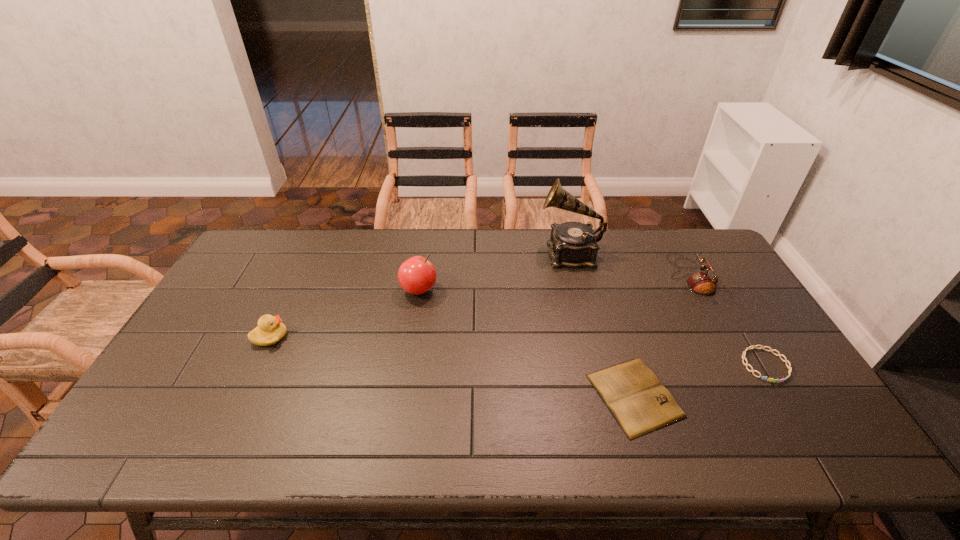
Where is `object that is positioned at the near edge`? The height and width of the screenshot is (540, 960). object that is positioned at the near edge is located at coordinates coord(639,402).

In order to click on telephone situated at the right edge in this screenshot , I will do `click(701, 283)`.

The width and height of the screenshot is (960, 540). I want to click on bracelet located in the right edge section of the desktop, so click(786, 361).

This screenshot has width=960, height=540. Find the location of `object that is at the far right corner`. object that is at the far right corner is located at coordinates (701, 283).

This screenshot has height=540, width=960. I want to click on vacant area at the far edge, so click(x=632, y=230).

Where is `free location at the near edge`? The width and height of the screenshot is (960, 540). free location at the near edge is located at coordinates pyautogui.click(x=286, y=426).

The width and height of the screenshot is (960, 540). What are the coordinates of `vacant area at the left edge of the desktop` in the screenshot? It's located at (234, 310).

Locate an element on the screen. The image size is (960, 540). vacant space at the right edge is located at coordinates (762, 407).

Find the location of `vacant space at the far left corner of the desktop`. vacant space at the far left corner of the desktop is located at coordinates (257, 228).

What are the coordinates of `blank area at the near left corner` in the screenshot? It's located at (175, 422).